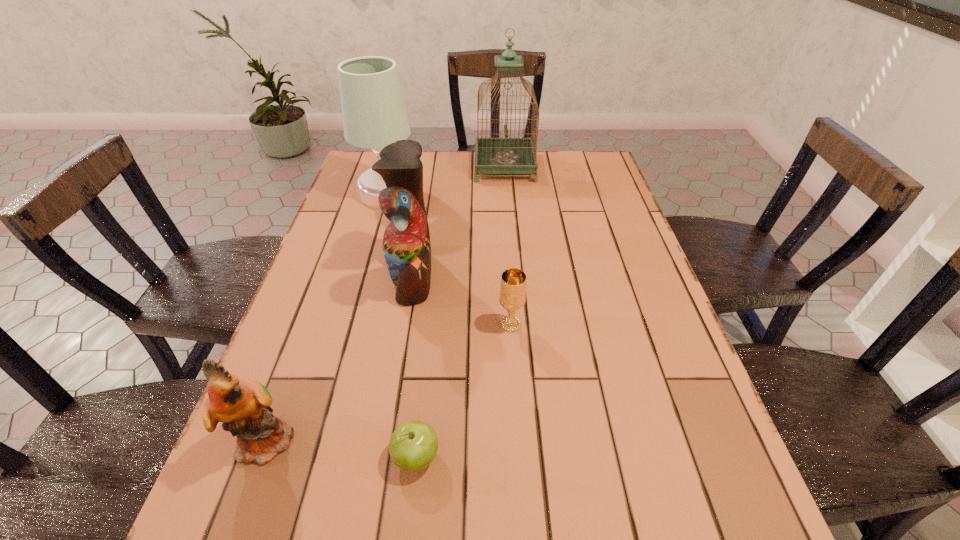
Locate an element on the screen. This screenshot has height=540, width=960. free space between the shorter parrot and the third farthest object is located at coordinates (341, 357).

Identify the location of empty location between the chalice and the lampshade. The height and width of the screenshot is (540, 960). (449, 258).

You are a GUI agent. You are given a task and a screenshot of the screen. Output one action in this format:
    pyautogui.click(x=<x>, y=<y>)
    Task: Click on the free point between the farther parrot and the birdcage
    The image size is (960, 540).
    Given the screenshot: What is the action you would take?
    pyautogui.click(x=459, y=221)

Find the location of `free spot between the lampshade and the shorter parrot`. free spot between the lampshade and the shorter parrot is located at coordinates (328, 316).

Locate an element on the screen. free spot between the lampshade and the apple is located at coordinates (402, 325).

Where is `object that is the nearest to the chalice`? Image resolution: width=960 pixels, height=540 pixels. object that is the nearest to the chalice is located at coordinates (406, 243).

At what (x,y) coordinates should I click in order to perform the action: click on the third closest object to the third farthest object. Please return your answer as a coordinate pair (x, y). This screenshot has width=960, height=540. Looking at the image, I should click on (243, 406).

The height and width of the screenshot is (540, 960). I want to click on free space that satisfies the following two spatial constraints: 1. at the face of the fourth nearest object; 2. on the left side of the shortest object, so click(383, 457).